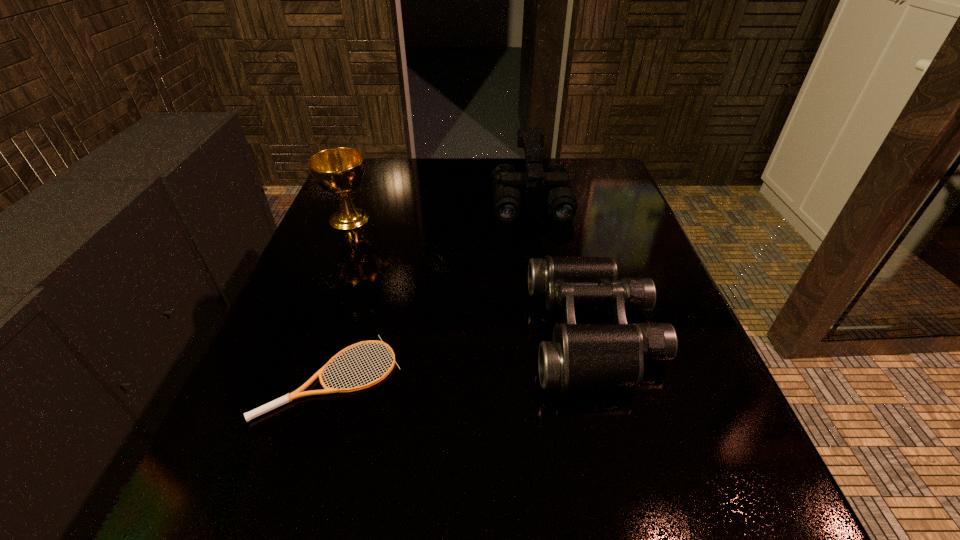
What are the coordinates of `unoccupied area between the tennis racket and the second shortest object` in the screenshot? It's located at (463, 354).

Locate an element on the screen. vacant point located between the shorter binoculars and the shortest object is located at coordinates (463, 354).

Image resolution: width=960 pixels, height=540 pixels. Find the location of `free spot between the shorter binoculars and the chalice`. free spot between the shorter binoculars and the chalice is located at coordinates (471, 275).

Image resolution: width=960 pixels, height=540 pixels. Identify the location of unoccupied position between the shortest object and the chalice. (341, 298).

Find the location of a particular element. empty location between the taller binoculars and the shortest object is located at coordinates (431, 288).

The image size is (960, 540). I want to click on vacant region between the chalice and the second shortest object, so click(471, 275).

The height and width of the screenshot is (540, 960). In order to click on free spot between the farther binoculars and the chalice in this screenshot , I will do `click(440, 209)`.

Where is `object that stands as the closest to the taller binoculars`? The height and width of the screenshot is (540, 960). object that stands as the closest to the taller binoculars is located at coordinates (581, 356).

Locate which object is the second closest to the tennis racket. Please provide its 2D coordinates. Your answer should be formatted as a tuple, i.e. [(x, y)], where the tuple contains the x and y coordinates of a point satisfying the conditions above.

[(339, 170)]